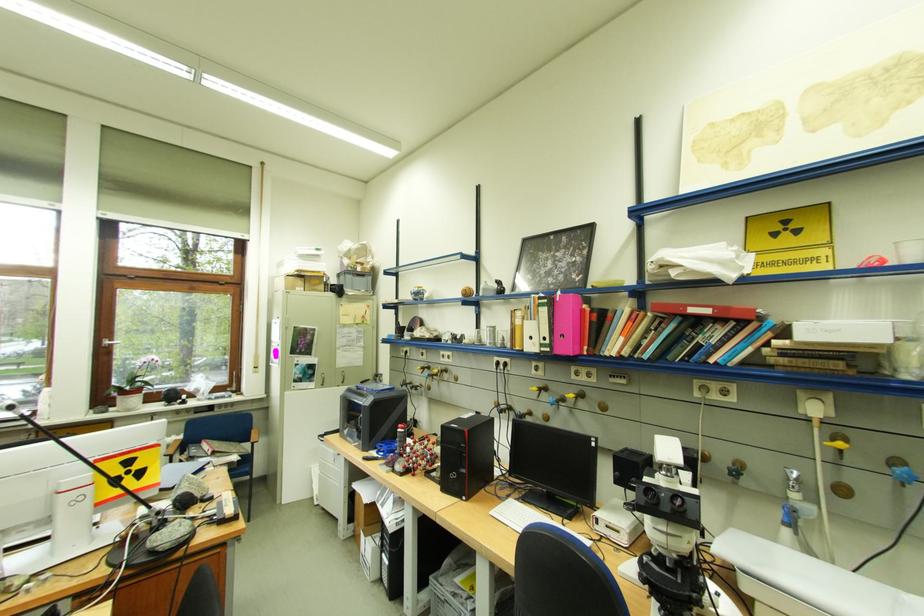
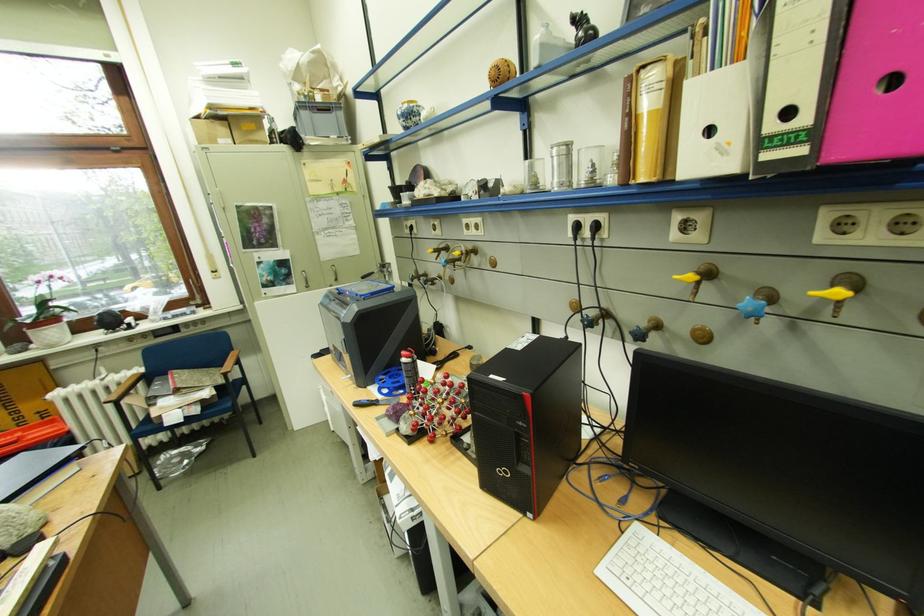
Question: What movement of the cameraman would produce the second image?

Choices:
 (A) Left
 (B) Right
 (C) Forward
 (D) Backward

Answer: (C)